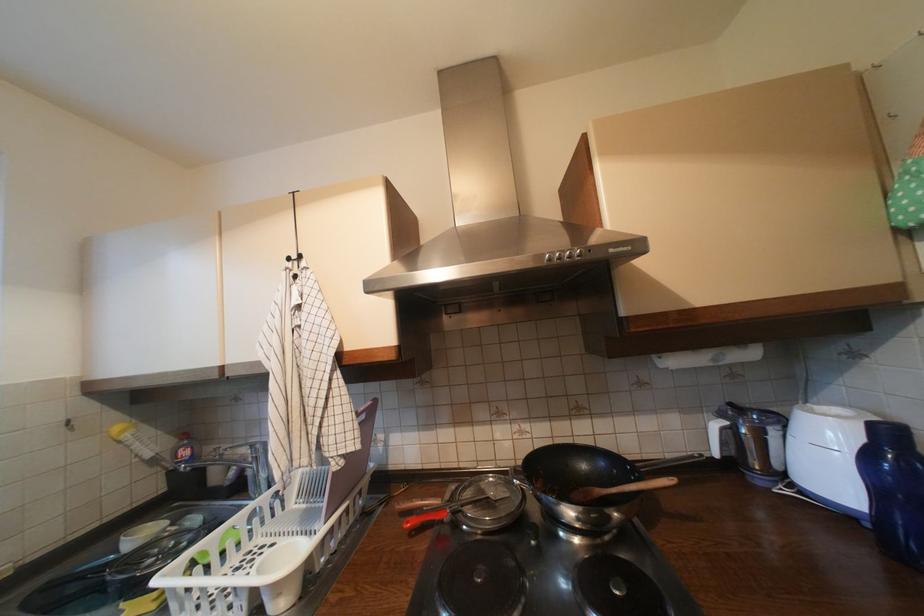
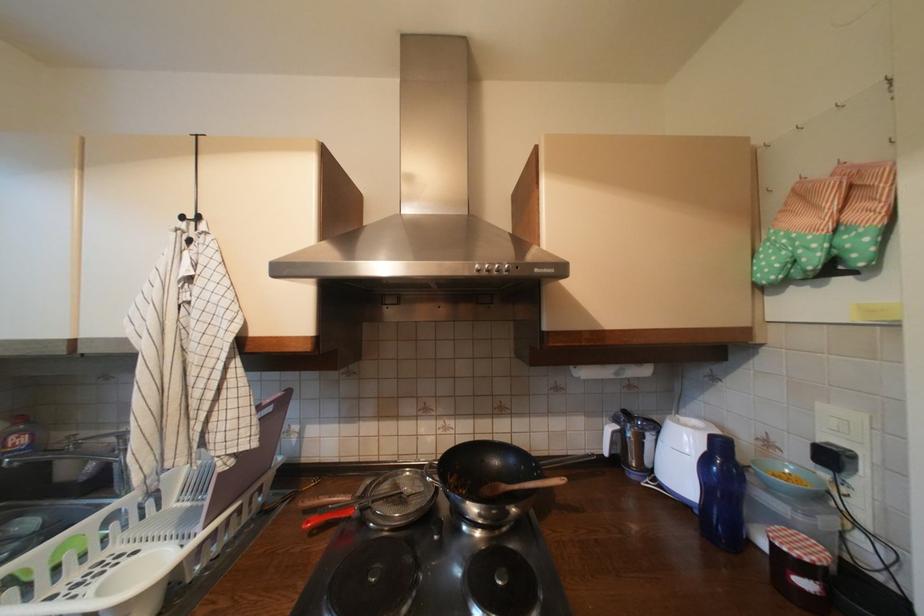
Where in the second image is the point corresponding to point 874,525 from the first image?

(704, 513)